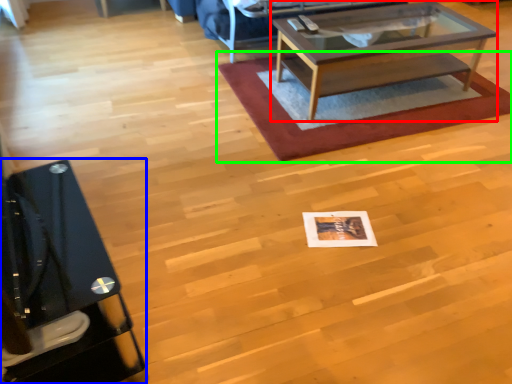
Question: Estimate the real-world distances between objects in this image. Which object is farther from coffee table (highlighted by a red box), desk (highlighted by a blue box) or mat (highlighted by a green box)?

Choices:
 (A) desk
 (B) mat

Answer: (A)